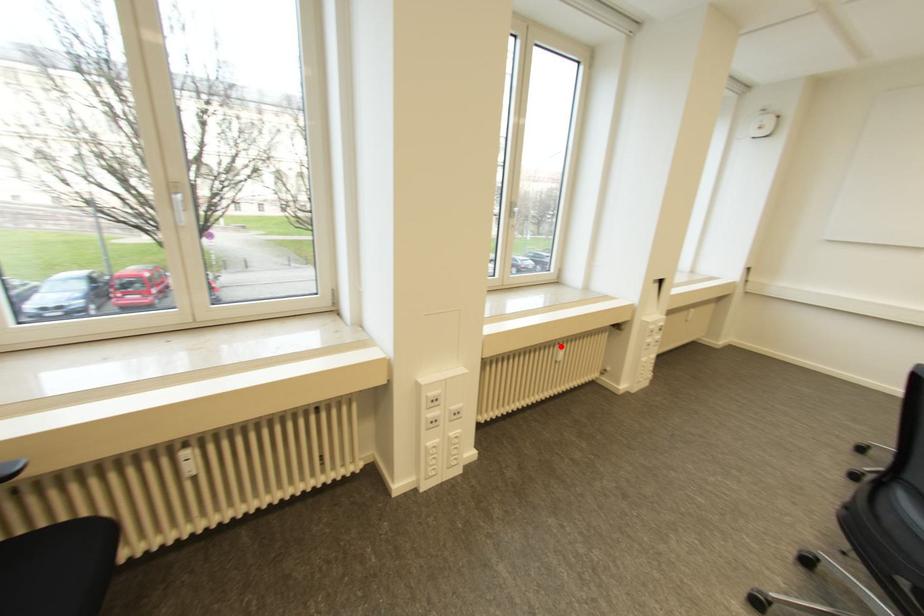
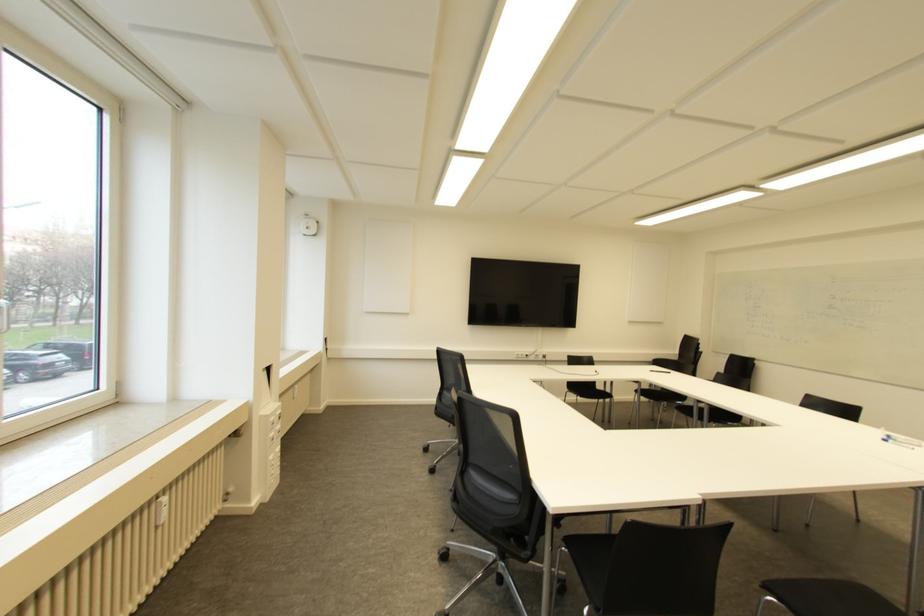
In the second image, find the point that corresponds to the highlighted location in the first image.

(163, 499)